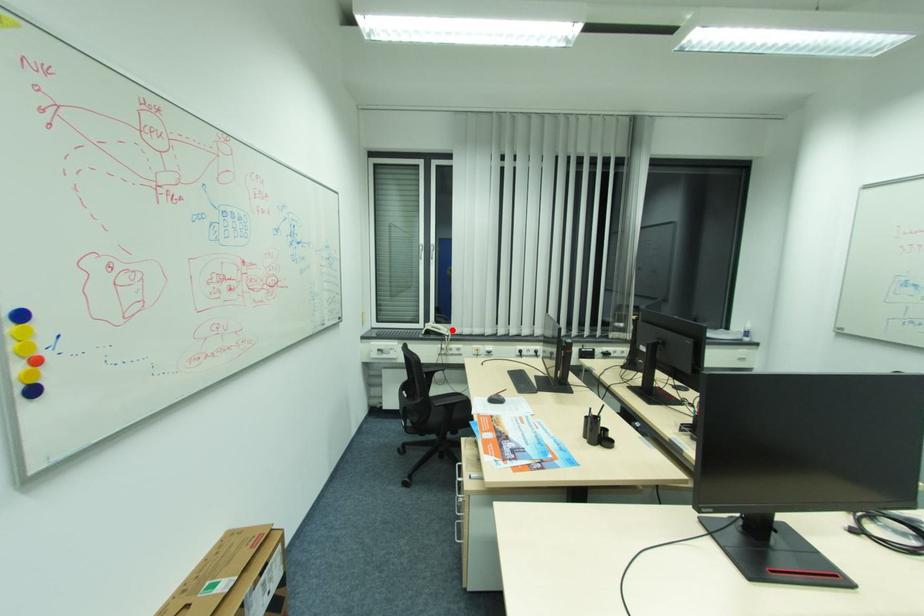
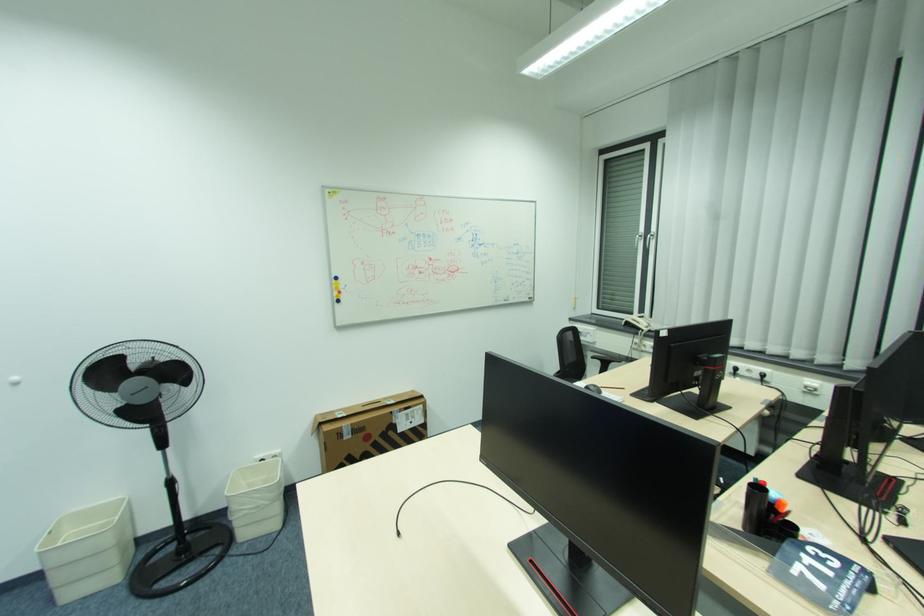
Find the pixel in the second image that matches the highlighted location in the first image.

(650, 325)